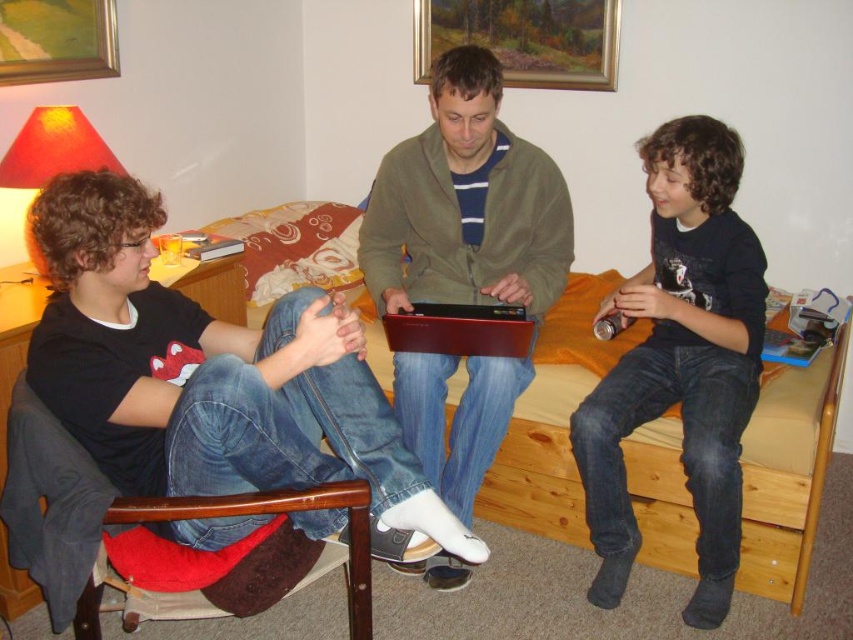
You are a photographer trying to capture a candid shot of the black matte shirt at left and the wooden picture frame at upper left. Since you want to ensure both are in focus, you need to know which object is taller. Can you determine which one is taller?

The black matte shirt at left has a greater height compared to the wooden picture frame at upper left, so the black matte shirt at left is taller.

You are standing in the room and want to place a small plant between the matte green jacket at center and the wooden picture frame at upper center. Can you fit it there?

The matte green jacket at center is positioned under the wooden picture frame at upper center, so there is vertical space between them. The small plant can be placed in that vertical gap.

You are standing at the origin of the coordinate system in this room. You want to move towards the point at (433, 294). Will you pass by the point at (508, 22) on your way there?

No, because point (433, 294) is in front of point (508, 22), so moving towards the former would not require passing the latter.